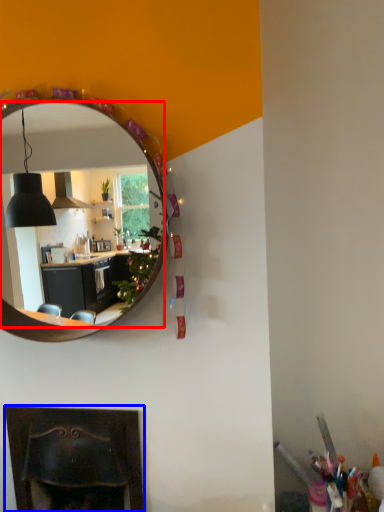
Question: Which object is further to the camera taking this photo, mirror (highlighted by a red box) or fireplace (highlighted by a blue box)?

Choices:
 (A) mirror
 (B) fireplace

Answer: (B)